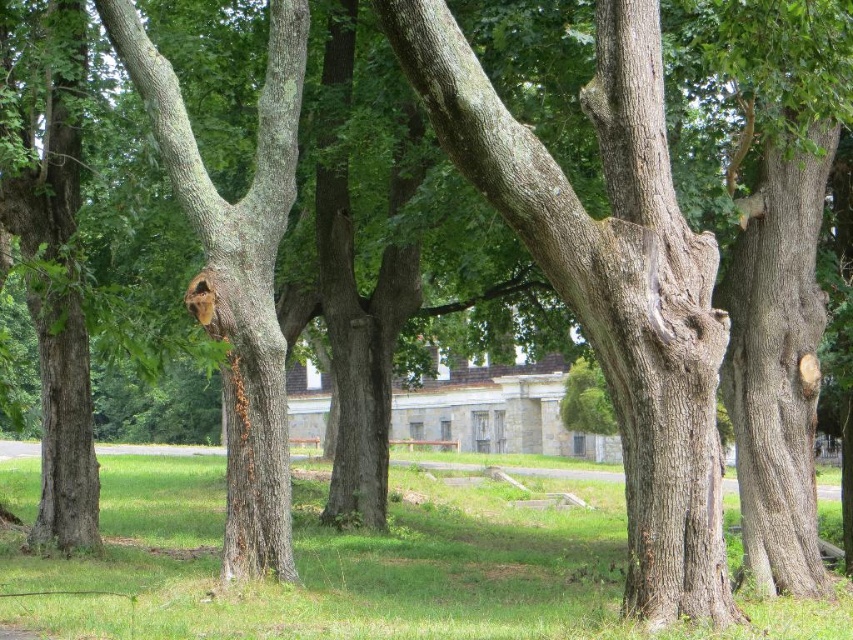
You are standing in the serene outdoor scene with the large oak trees and the stone building. You notice two points marked in the image. The first point is at coordinate point (345,625) and the second is at point (250,292). Which of these two points is closer to you from your current viewpoint?

Point (345,625) is in front of point (250,292), so it is closer to you.

You are standing in the middle of the scene and want to walk towards the green grass at center. Which direction should you move relative to the smooth bark tree at center?

The green grass at center is to the right of the smooth bark tree at center, so you should move to the right to reach it.